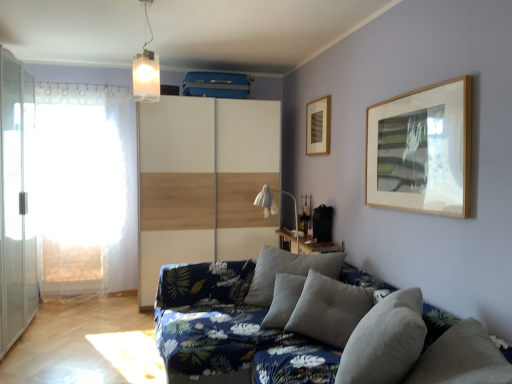
Question: Is textured gray cushions at lower right positioned with its back to wooden picture frame at upper center?

Choices:
 (A) yes
 (B) no

Answer: (B)

Question: Considering the relative sizes of textured gray cushions at lower right and wooden picture frame at upper center in the image provided, is textured gray cushions at lower right taller than wooden picture frame at upper center?

Choices:
 (A) yes
 (B) no

Answer: (A)

Question: Is textured gray cushions at lower right not close to wooden picture frame at upper center?

Choices:
 (A) no
 (B) yes

Answer: (B)

Question: Can you confirm if textured gray cushions at lower right is smaller than wooden picture frame at upper center?

Choices:
 (A) yes
 (B) no

Answer: (B)

Question: Is textured gray cushions at lower right wider than wooden picture frame at upper center?

Choices:
 (A) no
 (B) yes

Answer: (B)

Question: From the image's perspective, is white lace curtain at left above or below transparent glass screen door at left?

Choices:
 (A) below
 (B) above

Answer: (B)

Question: Considering the positions of white lace curtain at left and transparent glass screen door at left in the image, is white lace curtain at left wider or thinner than transparent glass screen door at left?

Choices:
 (A) thin
 (B) wide

Answer: (A)

Question: Considering the positions of white lace curtain at left and transparent glass screen door at left in the image, is white lace curtain at left bigger or smaller than transparent glass screen door at left?

Choices:
 (A) big
 (B) small

Answer: (B)

Question: Is point (53, 240) closer or farther from the camera than point (10, 302)?

Choices:
 (A) farther
 (B) closer

Answer: (A)

Question: From their relative heights in the image, would you say white matte rectangular light fixture at upper center is taller or shorter than white wood dresser at center?

Choices:
 (A) short
 (B) tall

Answer: (A)

Question: From a real-world perspective, is white matte rectangular light fixture at upper center above or below white wood dresser at center?

Choices:
 (A) above
 (B) below

Answer: (A)

Question: From the image's perspective, relative to white wood dresser at center, is white matte rectangular light fixture at upper center above or below?

Choices:
 (A) below
 (B) above

Answer: (B)

Question: Considering the positions of white matte rectangular light fixture at upper center and white wood dresser at center in the image, is white matte rectangular light fixture at upper center bigger or smaller than white wood dresser at center?

Choices:
 (A) small
 (B) big

Answer: (A)

Question: From the image's perspective, relative to wooden table at center, is white fabric table lamp at center above or below?

Choices:
 (A) above
 (B) below

Answer: (A)

Question: From a real-world perspective, is white fabric table lamp at center above or below wooden table at center?

Choices:
 (A) below
 (B) above

Answer: (B)